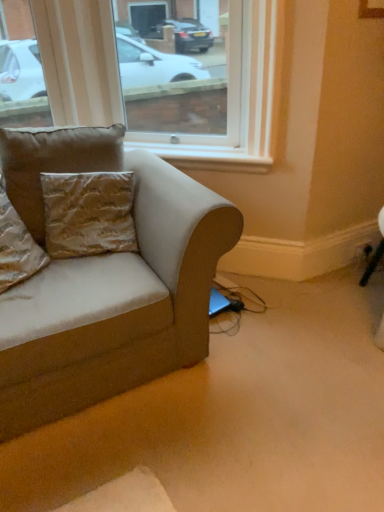
This screenshot has height=512, width=384. Find the location of `vacant area located to the right-hand side of suede-like beige couch at left`. vacant area located to the right-hand side of suede-like beige couch at left is located at coordinates (292, 356).